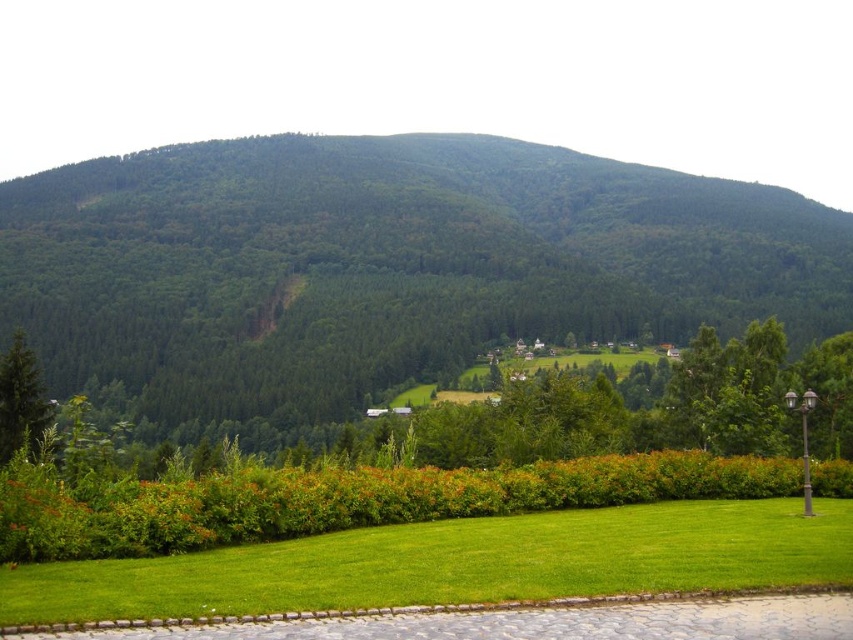
Question: Which object is closer to the camera taking this photo?

Choices:
 (A) green matte tree at lower left
 (B) green forested mountain at upper center
 (C) green lawn at center

Answer: (C)

Question: Is green forested mountain at upper center thinner than green lawn at center?

Choices:
 (A) yes
 (B) no

Answer: (B)

Question: Estimate the real-world distances between objects in this image. Which object is closer to the green matte tree at lower left?

Choices:
 (A) green forested mountain at upper center
 (B) green lawn at center

Answer: (B)

Question: Does green forested mountain at upper center appear over green lawn at center?

Choices:
 (A) yes
 (B) no

Answer: (A)

Question: Does green forested mountain at upper center have a greater width compared to green matte tree at lower left?

Choices:
 (A) no
 (B) yes

Answer: (B)

Question: Estimate the real-world distances between objects in this image. Which object is farther from the green lawn at center?

Choices:
 (A) green matte tree at lower left
 (B) green forested mountain at upper center

Answer: (B)